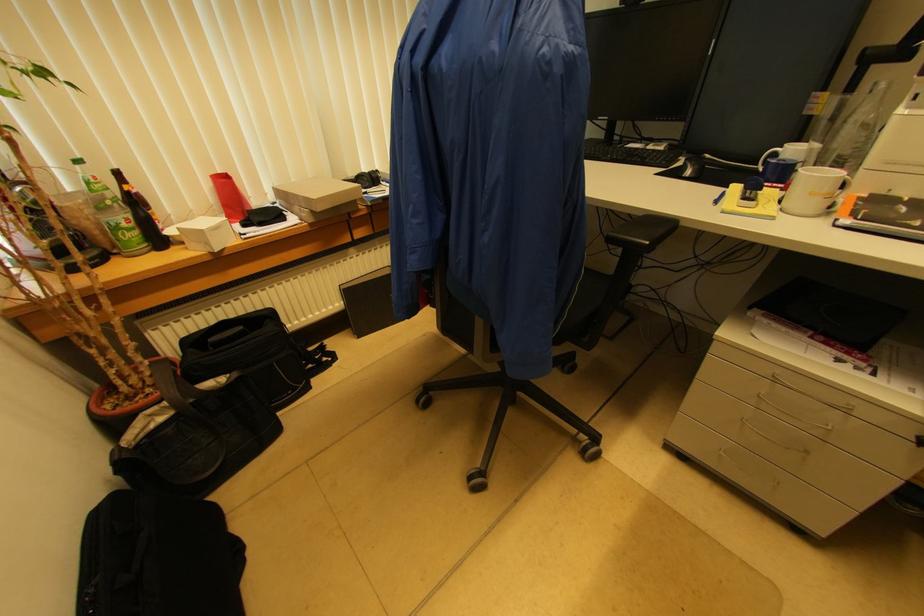
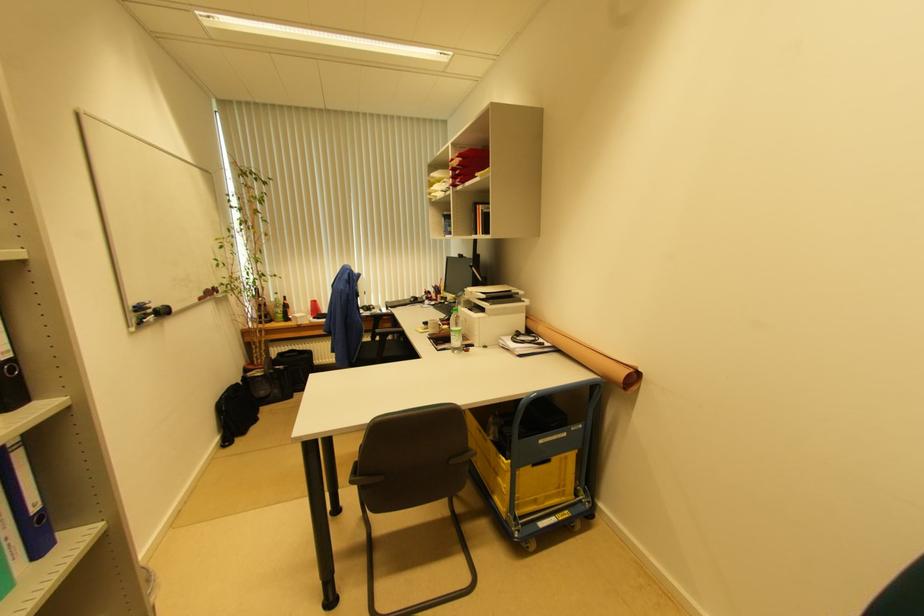
Find the pixel in the second image that matches point (222, 175) in the first image.

(315, 302)